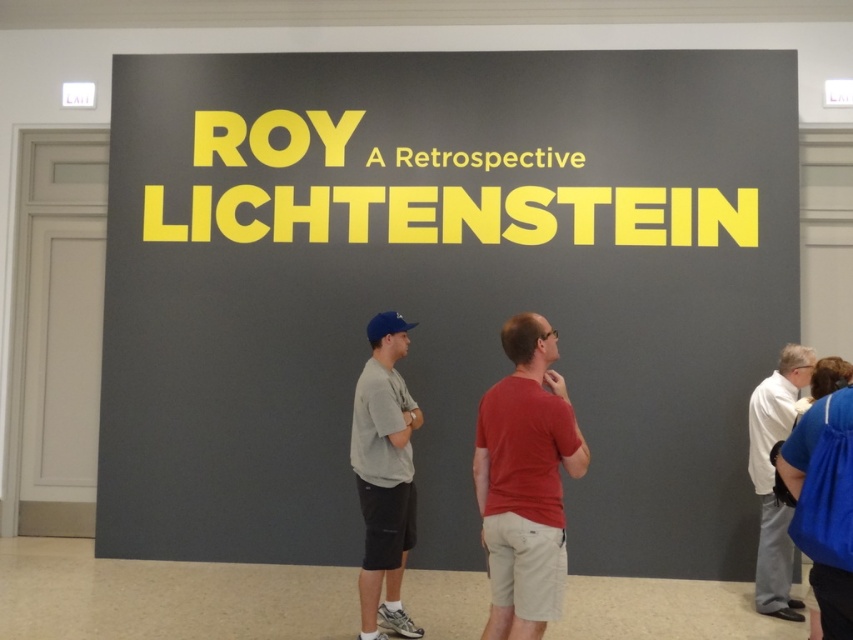
You are an art student who just arrived at the exhibition entrance. You notice the matte yellow text at center and the gray fabric shirt at center. Which object is covering the other one?

The matte yellow text at center is positioned over the gray fabric shirt at center, so it is covering the shirt.

You are standing in front of the exhibition entrance and see two points marked on the wall. The first point is at coordinate (331, 268) and the second is at (786, 596). Which point is closer to you?

Point (331, 268) is closer to you because it is further to the viewer than point (786, 596).